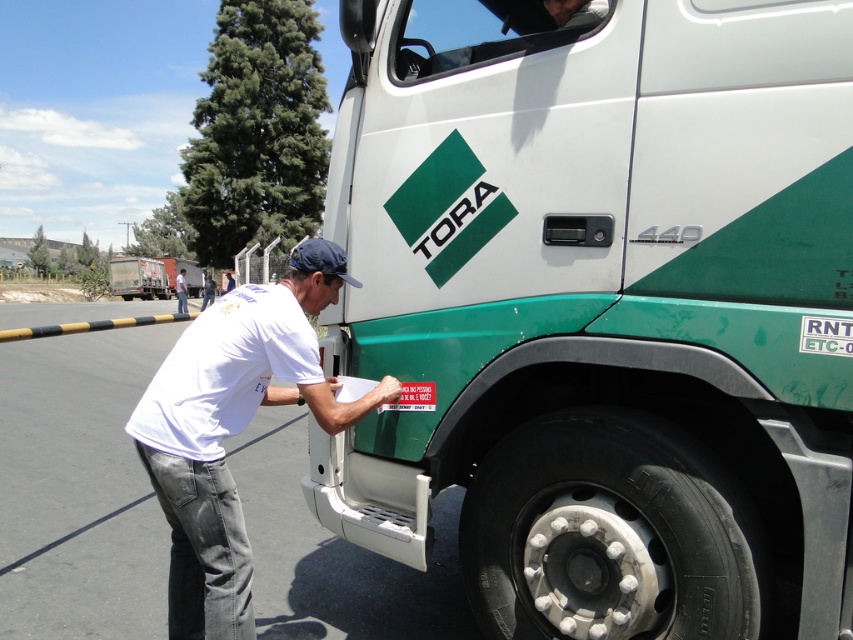
Question: Estimate the real-world distances between objects in this image. Which object is farther from the green matte trailer truck at upper center?

Choices:
 (A) white cotton shirt at lower left
 (B) white t-shirt at lower left
 (C) green matte truck at center

Answer: (A)

Question: Estimate the real-world distances between objects in this image. Which object is farther from the green matte trailer truck at upper center?

Choices:
 (A) white t-shirt at lower left
 (B) green matte trailer truck at left

Answer: (B)

Question: Does matte black headrest at upper center appear over white t-shirt at lower left?

Choices:
 (A) yes
 (B) no

Answer: (B)

Question: Which object appears farthest from the camera in this image?

Choices:
 (A) matte black headrest at upper center
 (B) white t-shirt at lower left
 (C) green matte trailer truck at upper center

Answer: (C)

Question: Observing the image, what is the correct spatial positioning of white cotton shirt at lower left in reference to green matte trailer truck at left?

Choices:
 (A) right
 (B) left

Answer: (A)

Question: Does white cotton shirt at lower left appear over matte black headrest at upper center?

Choices:
 (A) yes
 (B) no

Answer: (B)